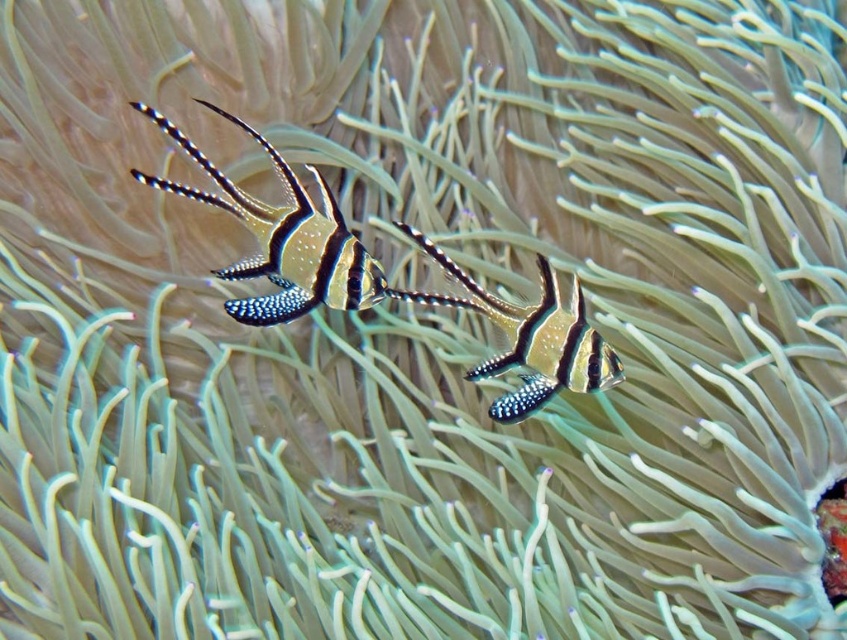
You are a marine biologist observing the two black and white striped fish in the image. Which fish is closer to the camera, the black and white striped fish at left or the black and white striped fish at center?

The black and white striped fish at left is closer to the camera because it is in front of the black and white striped fish at center.

Looking at this image, you are a marine biologist observing the Banggai cardinalfish in their natural habitat. You notice a point labeled at coordinates (281,237). Based on the scene description, what does this point likely mark?

The point at coordinates (281,237) marks the location of the black and white striped fish at left as described in the scene.